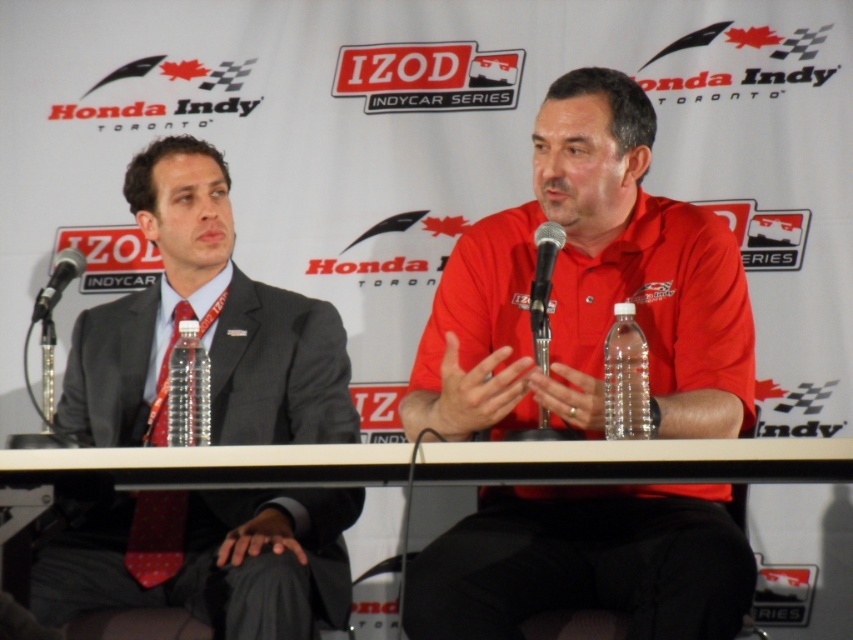
Question: Can you confirm if red dotted tie at left is positioned to the right of clear plastic bottle at center?

Choices:
 (A) no
 (B) yes

Answer: (A)

Question: Which object is the farthest from the red dotted tie at left?

Choices:
 (A) black metallic microphone at left
 (B) white plastic table at center
 (C) matte black suit at left

Answer: (B)

Question: Considering the relative positions of matte red shirt at center and white plastic table at center in the image provided, where is matte red shirt at center located with respect to white plastic table at center?

Choices:
 (A) above
 (B) below

Answer: (A)

Question: Which of the following is the closest to the observer?

Choices:
 (A) clear plastic bottle at center
 (B) matte red shirt at center
 (C) white plastic table at center
 (D) black metallic microphone at left

Answer: (C)

Question: Which point is closer to the camera?

Choices:
 (A) (625, 360)
 (B) (134, 577)
 (C) (805, 449)

Answer: (C)

Question: Can you confirm if red dotted tie at left is positioned above metallic silver microphone at center?

Choices:
 (A) yes
 (B) no

Answer: (B)